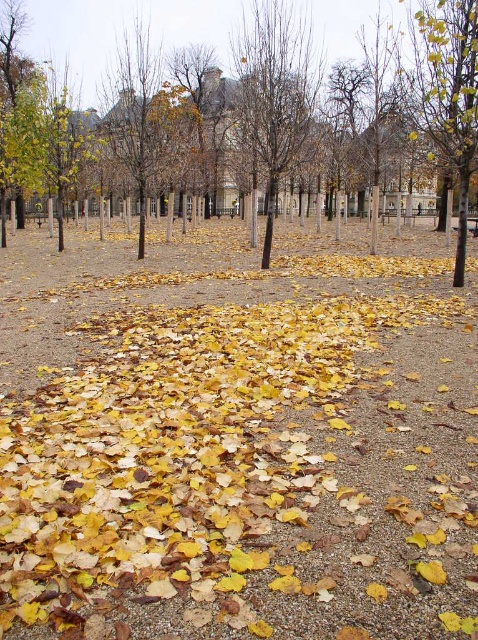
Which is below, yellow dry leaves at center or bare branches at center?

yellow dry leaves at center is below.

Does yellow dry leaves at center appear on the right side of bare branches at center?

No, yellow dry leaves at center is not to the right of bare branches at center.

What do you see at coordinates (238, 436) in the screenshot? I see `yellow dry leaves at center` at bounding box center [238, 436].

Identify the location of yellow dry leaves at center. (238, 436).

Does yellow dry leaves at center have a lesser width compared to yellow-green leaves at upper right?

No.

In order to click on yellow dry leaves at center in this screenshot , I will do `click(238, 436)`.

Between point (166, 516) and point (413, 51), which one is positioned in front?

Point (166, 516) is more forward.

This screenshot has width=478, height=640. In order to click on yellow dry leaves at center in this screenshot , I will do `click(238, 436)`.

Can you confirm if yellow dry leaves at center is positioned above yellow leafy tree at center?

Actually, yellow dry leaves at center is below yellow leafy tree at center.

Is point (159, 561) positioned in front of point (297, 128)?

Yes, it is in front of point (297, 128).

At what (x,y) coordinates should I click in order to perform the action: click on yellow dry leaves at center. Please return your answer as a coordinate pair (x, y). Looking at the image, I should click on (238, 436).